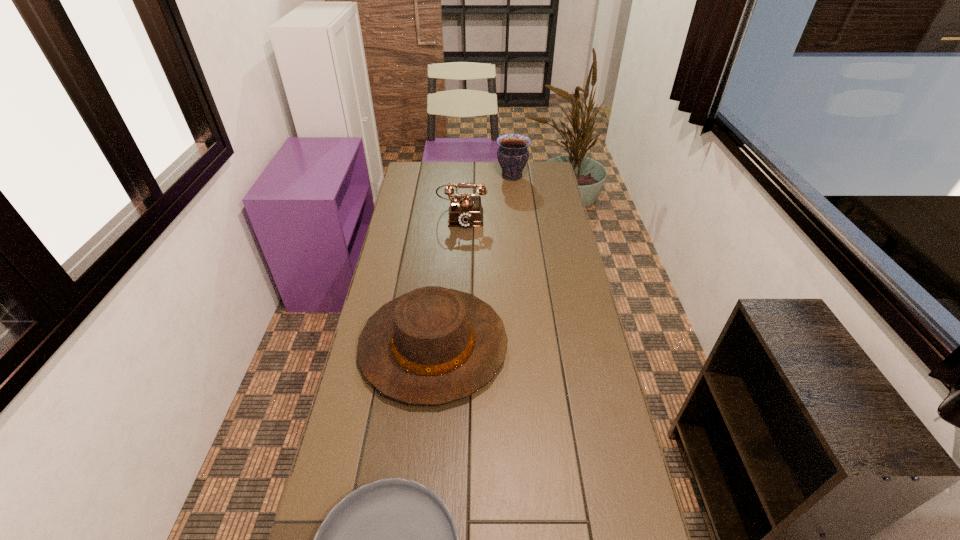
Locate an element on the screen. object situated at the right edge is located at coordinates (512, 154).

I want to click on object that is at the far right corner, so click(512, 154).

Image resolution: width=960 pixels, height=540 pixels. What are the coordinates of `vacant space at the far edge of the desktop` in the screenshot? It's located at (466, 169).

Identify the location of free space at the left edge. The height and width of the screenshot is (540, 960). (375, 285).

Where is `vacant point at the right edge`? vacant point at the right edge is located at coordinates (574, 247).

The height and width of the screenshot is (540, 960). In the image, there is a desktop. Find the location of `free region at the far right corner`. free region at the far right corner is located at coordinates (525, 168).

The width and height of the screenshot is (960, 540). I want to click on vacant area between the pottery and the cowboy hat, so click(x=472, y=261).

The height and width of the screenshot is (540, 960). What are the coordinates of `empty space that is in between the pottery and the third farthest object` in the screenshot? It's located at coord(472,261).

This screenshot has height=540, width=960. What are the coordinates of `free area in between the second farthest object and the third farthest object` in the screenshot? It's located at (448, 280).

At what (x,y) coordinates should I click in order to perform the action: click on blank region between the second farthest object and the cowboy hat. Please return your answer as a coordinate pair (x, y). The image size is (960, 540). Looking at the image, I should click on (448, 280).